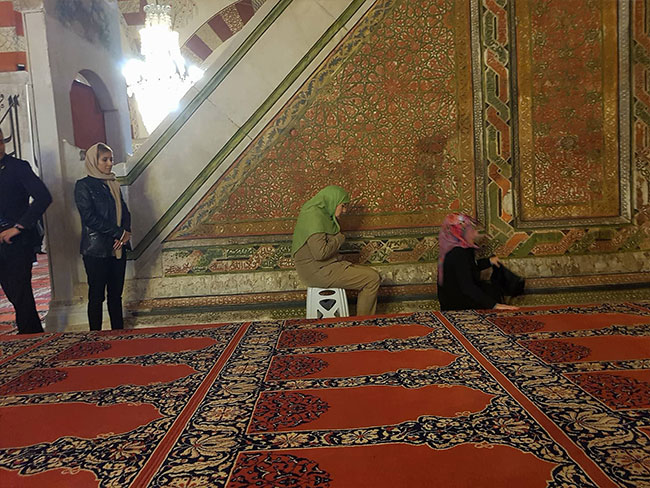
Find the location of `chandelier`. chandelier is located at coordinates (162, 78).